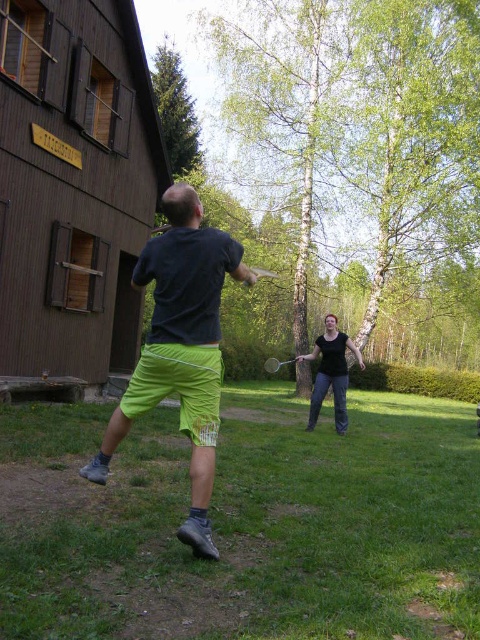
Between black cotton shirt at center and metallic silver badminton racket at center, which one is positioned higher?

black cotton shirt at center is higher up.

Find the location of `black cotton shirt at center`. black cotton shirt at center is located at coordinates (331, 372).

Where is `black cotton shirt at center`? This screenshot has width=480, height=640. black cotton shirt at center is located at coordinates (331, 372).

Is the position of neon green shorts at center more distant than that of metallic silver badminton racket at center?

No, neon green shorts at center is in front of metallic silver badminton racket at center.

Who is taller, neon green shorts at center or metallic silver badminton racket at center?

neon green shorts at center

Is point (134, 404) closer to viewer compared to point (271, 371)?

Yes, it is in front of point (271, 371).

In order to click on neon green shorts at center in this screenshot , I will do `click(180, 348)`.

Between neon green shorts at center and black cotton shirt at center, which one appears on the right side from the viewer's perspective?

black cotton shirt at center

Is neon green shorts at center wider than black cotton shirt at center?

Indeed, neon green shorts at center has a greater width compared to black cotton shirt at center.

What do you see at coordinates (180, 348) in the screenshot? This screenshot has height=640, width=480. I see `neon green shorts at center` at bounding box center [180, 348].

Locate an element on the screen. Image resolution: width=480 pixels, height=640 pixels. neon green shorts at center is located at coordinates (180, 348).